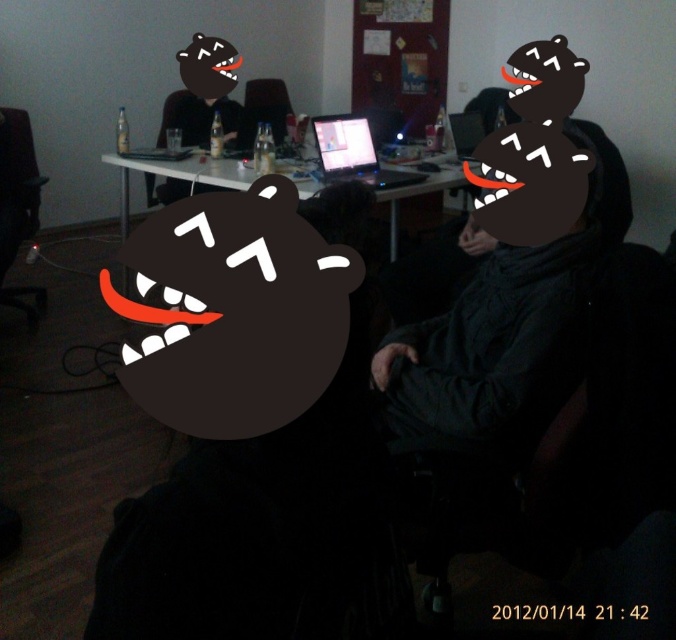
Question: Estimate the real-world distances between objects in this image. Which object is farther from the matte black laptop at center?

Choices:
 (A) matte black laptop at upper center
 (B) black matte bear head at center
 (C) black plastic chair at left
 (D) white glossy table at center

Answer: (B)

Question: Does black plastic chair at left have a lesser width compared to matte black laptop at center?

Choices:
 (A) yes
 (B) no

Answer: (A)

Question: Which object is closer to the camera taking this photo?

Choices:
 (A) matte black face at center
 (B) matte black laptop at upper center
 (C) black matte bear head at center

Answer: (C)

Question: Estimate the real-world distances between objects in this image. Which object is farther from the black plastic chair at left?

Choices:
 (A) matte black face at center
 (B) matte plastic laptop at center
 (C) matte black laptop at upper center

Answer: (A)

Question: Does matte black face at center have a greater width compared to matte plastic laptop at center?

Choices:
 (A) yes
 (B) no

Answer: (A)

Question: Does black plastic chair at left appear on the right side of white glossy table at center?

Choices:
 (A) yes
 (B) no

Answer: (B)